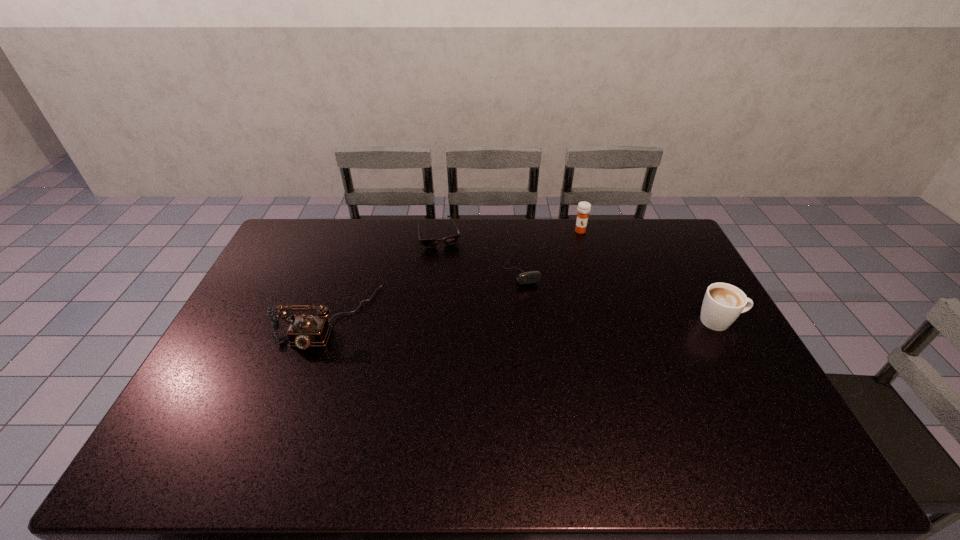
This screenshot has width=960, height=540. Identify the location of object at the left edge. (304, 331).

You are a GUI agent. You are given a task and a screenshot of the screen. Output one action in this format:
    pyautogui.click(x=<x>, y=<y>)
    Task: Click on the object positioned at the right edge
    The image size is (960, 540).
    Given the screenshot: What is the action you would take?
    pyautogui.click(x=723, y=303)

In the image, there is a desktop. Where is `vacant space at the far edge`? vacant space at the far edge is located at coordinates (481, 250).

Find the location of a particular element. This screenshot has height=540, width=960. free space at the left edge of the desktop is located at coordinates (303, 259).

The width and height of the screenshot is (960, 540). Find the location of `free spot at the right edge of the desktop`. free spot at the right edge of the desktop is located at coordinates (675, 290).

In the image, there is a desktop. Identify the location of vacant space at the far left corner. The image size is (960, 540). (292, 228).

At what (x,y) coordinates should I click in order to perform the action: click on vacant space at the near left corner. Please return your answer as a coordinate pair (x, y). The width and height of the screenshot is (960, 540). Looking at the image, I should click on (176, 424).

The image size is (960, 540). In order to click on free spot at the far right corner of the desktop in this screenshot , I will do `click(674, 229)`.

Locate an element on the screen. free space between the shortest object and the cappuccino is located at coordinates (580, 278).

Identify the location of unoccupied area between the telephone and the medicine. The width and height of the screenshot is (960, 540). point(454,275).